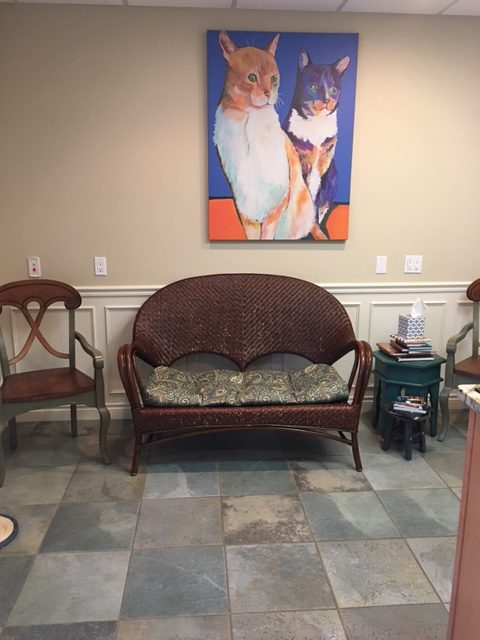
Locate an element on the screen. The width and height of the screenshot is (480, 640). wall switches is located at coordinates (407, 262), (382, 262), (102, 264), (31, 269).